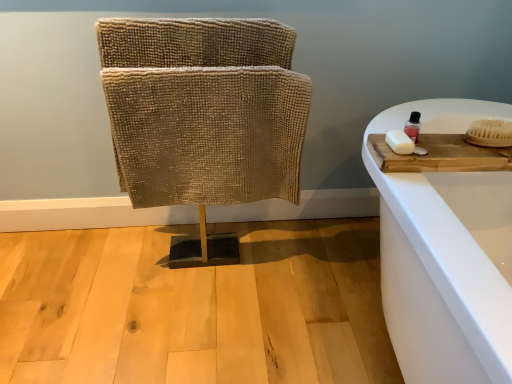
At what (x,y) coordinates should I click in order to perform the action: click on free spot below beige textured fabric at center (from a real-world perspective). Please return your answer as a coordinate pair (x, y). Looking at the image, I should click on (207, 248).